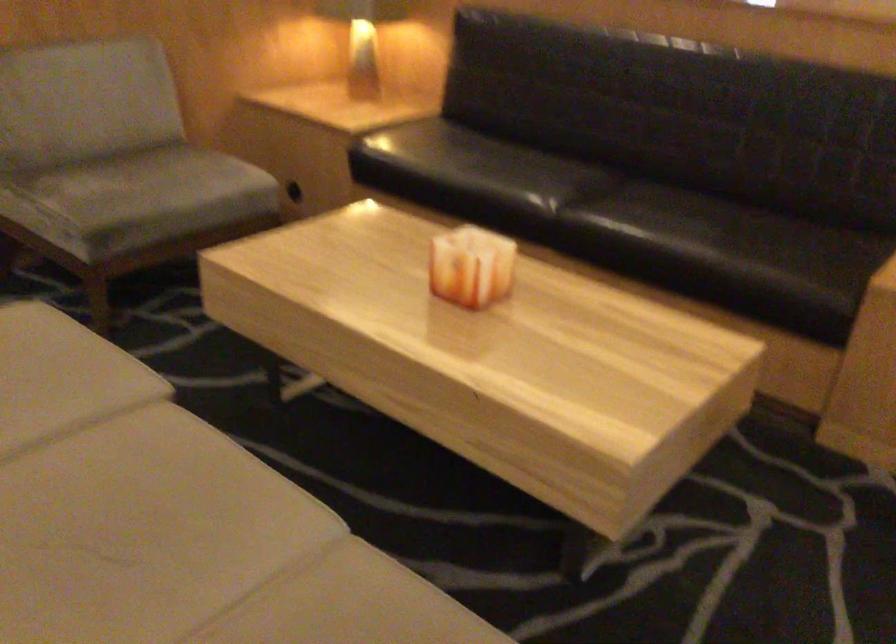
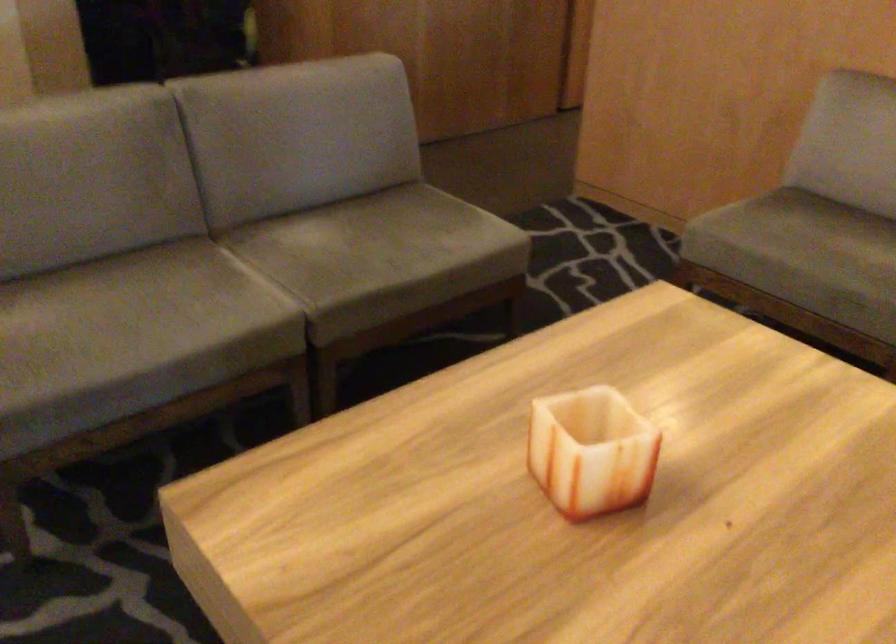
First-person continuous shooting, in which direction is the camera rotating?

The camera rotated toward left-down.